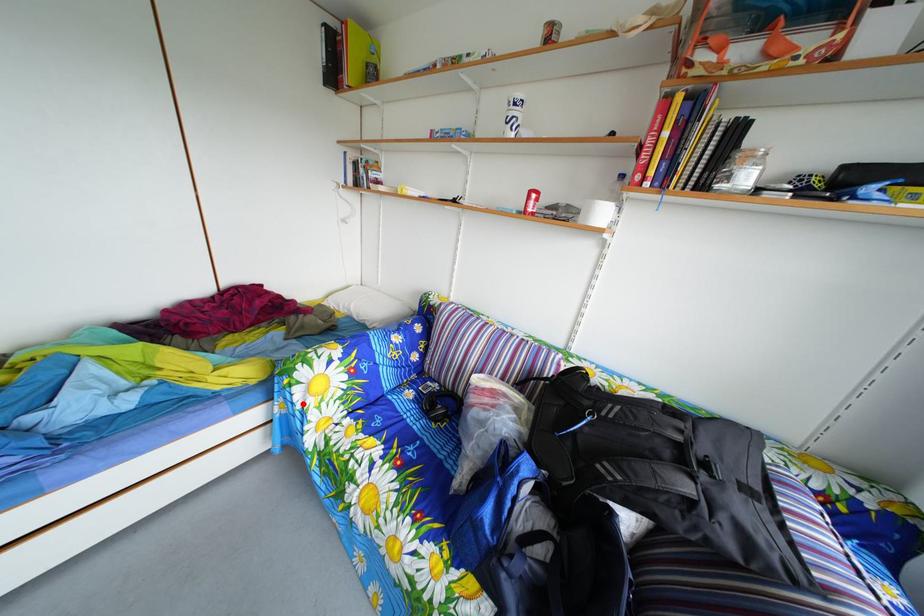
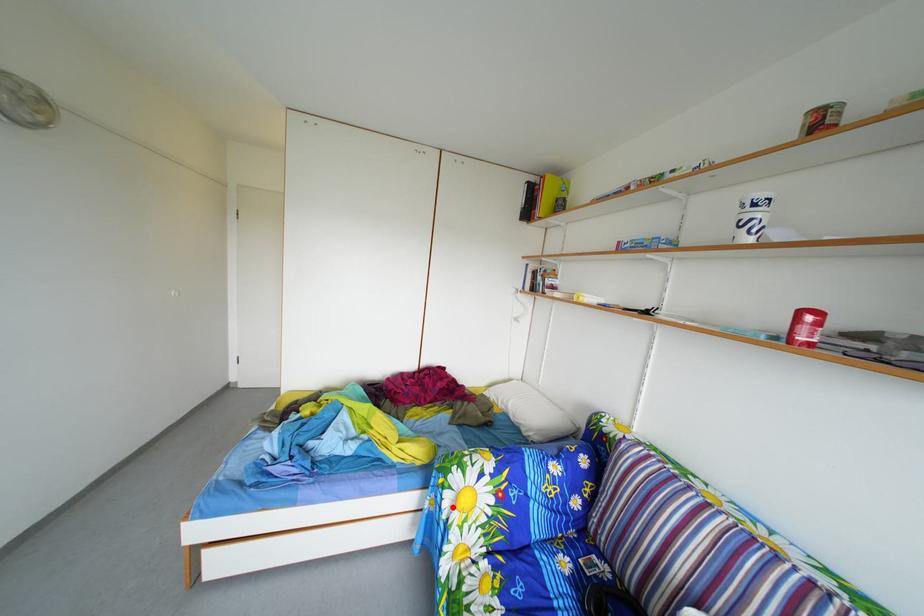
I am providing you with two images of the same scene from different viewpoints. A red point is marked on the first image and another point is marked on the second image. Are the points marked in image1 and image2 representing the same 3D position?

Yes